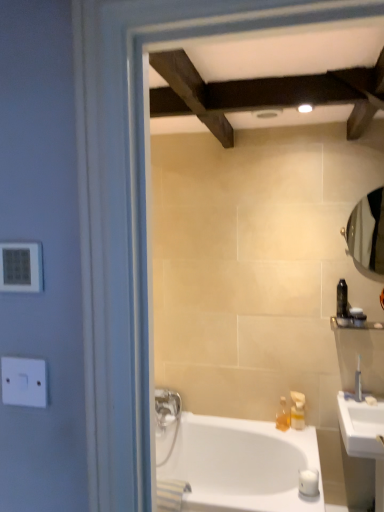
Question: Does clear glass mirror at right have a greater height compared to white plastic switch at left, the second electric outlet when ordered from top to bottom?

Choices:
 (A) no
 (B) yes

Answer: (B)

Question: Could you tell me if clear glass mirror at right is turned towards white plastic switch at left, which is the first electric outlet in bottom-to-top order?

Choices:
 (A) yes
 (B) no

Answer: (B)

Question: Is the depth of clear glass mirror at right greater than that of white plastic switch at left, the second electric outlet when ordered from top to bottom?

Choices:
 (A) yes
 (B) no

Answer: (A)

Question: From a real-world perspective, does clear glass mirror at right sit lower than white plastic switch at left, the second electric outlet when ordered from top to bottom?

Choices:
 (A) yes
 (B) no

Answer: (B)

Question: Is white plastic switch at left, the second electric outlet when ordered from top to bottom, at the back of clear glass mirror at right?

Choices:
 (A) yes
 (B) no

Answer: (B)

Question: Is translucent plastic soap dispenser at right, which is counted as the first toiletry, starting from the bottom, wider or thinner than white glossy bathtub at lower center?

Choices:
 (A) thin
 (B) wide

Answer: (A)

Question: Considering the positions of translucent plastic soap dispenser at right, placed as the third toiletry when sorted from top to bottom, and white glossy bathtub at lower center in the image, is translucent plastic soap dispenser at right, placed as the third toiletry when sorted from top to bottom, bigger or smaller than white glossy bathtub at lower center?

Choices:
 (A) small
 (B) big

Answer: (A)

Question: From their relative heights in the image, would you say translucent plastic soap dispenser at right, which ranks as the 1th toiletry in left-to-right order, is taller or shorter than white glossy bathtub at lower center?

Choices:
 (A) tall
 (B) short

Answer: (B)

Question: Would you say translucent plastic soap dispenser at right, which appears as the third toiletry when viewed from the right, is inside or outside white glossy bathtub at lower center?

Choices:
 (A) inside
 (B) outside

Answer: (B)

Question: From a real-world perspective, is white plastic switch at left, the second electric outlet when ordered from top to bottom, physically located above or below translucent plastic soap dispenser at right, which appears as the third toiletry when viewed from the right?

Choices:
 (A) above
 (B) below

Answer: (A)

Question: In terms of width, does white plastic switch at left, which is the first electric outlet in bottom-to-top order, look wider or thinner when compared to translucent plastic soap dispenser at right, placed as the third toiletry when sorted from top to bottom?

Choices:
 (A) wide
 (B) thin

Answer: (B)

Question: Considering the positions of white plastic switch at left, the second electric outlet when ordered from top to bottom, and translucent plastic soap dispenser at right, which ranks as the 1th toiletry in left-to-right order, in the image, is white plastic switch at left, the second electric outlet when ordered from top to bottom, bigger or smaller than translucent plastic soap dispenser at right, which ranks as the 1th toiletry in left-to-right order,?

Choices:
 (A) big
 (B) small

Answer: (B)

Question: In the image, is white plastic switch at left, the second electric outlet when ordered from top to bottom, positioned in front of or behind translucent plastic soap dispenser at right, which appears as the third toiletry when viewed from the right?

Choices:
 (A) front
 (B) behind

Answer: (A)

Question: From the image's perspective, is clear glass mirror at right above or below translucent plastic soap dispenser at right, which appears as the third toiletry when viewed from the right?

Choices:
 (A) below
 (B) above

Answer: (B)

Question: From a real-world perspective, is clear glass mirror at right above or below translucent plastic soap dispenser at right, which is counted as the first toiletry, starting from the bottom?

Choices:
 (A) below
 (B) above

Answer: (B)